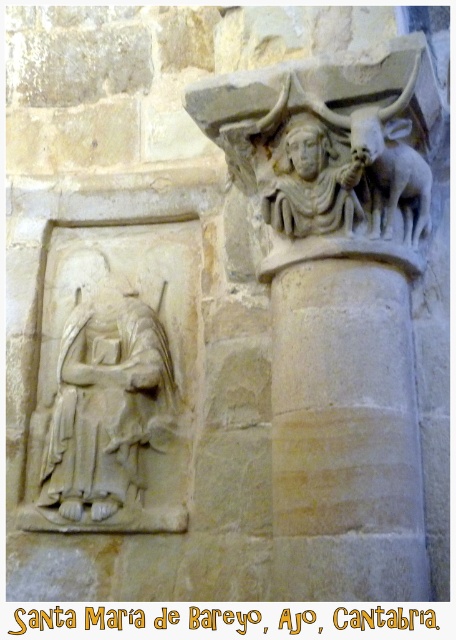
Question: Which of the following is the farthest from the observer?

Choices:
 (A) (309, 148)
 (B) (412, 515)

Answer: (A)

Question: Does white stone relief at left have a larger size compared to white stone carving at upper center?

Choices:
 (A) no
 (B) yes

Answer: (B)

Question: Which object is closer to the camera taking this photo?

Choices:
 (A) white stone relief at left
 (B) white stone carving at upper center
 (C) beige stone column at center

Answer: (C)

Question: Can you confirm if beige stone column at center is positioned to the left of white stone relief at left?

Choices:
 (A) yes
 (B) no

Answer: (B)

Question: Estimate the real-world distances between objects in this image. Which object is farther from the white stone relief at left?

Choices:
 (A) beige stone column at center
 (B) white stone carving at upper center

Answer: (B)

Question: Does beige stone column at center have a larger size compared to white stone relief at left?

Choices:
 (A) yes
 (B) no

Answer: (A)